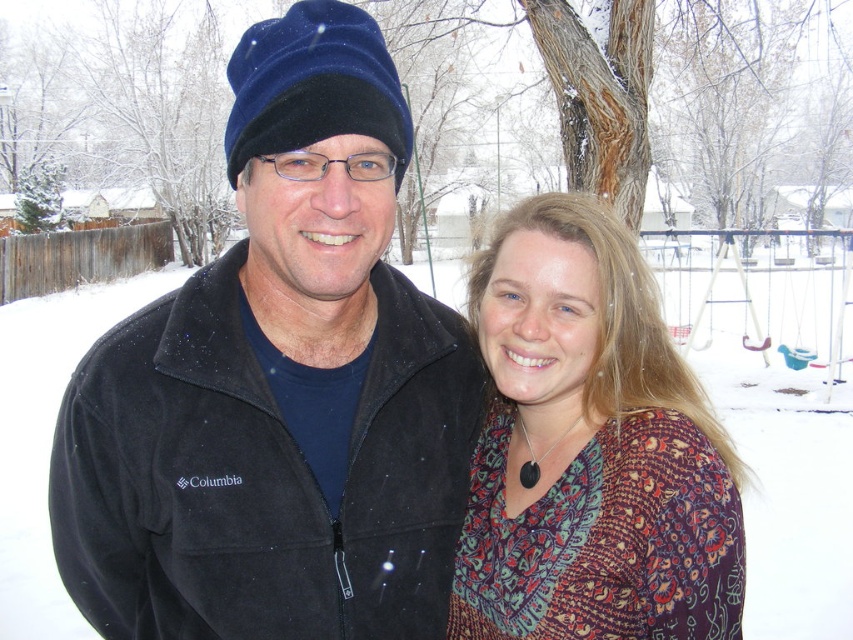
Question: Can you confirm if brown bark tree at upper center is positioned below patterned fabric blouse at center?

Choices:
 (A) yes
 (B) no

Answer: (B)

Question: Does suede jacket at center have a smaller size compared to brown bark tree at upper center?

Choices:
 (A) yes
 (B) no

Answer: (A)

Question: Which point is closer to the camera?

Choices:
 (A) white fluffy snow at center
 (B) patterned fabric blouse at center
 (C) brown bark tree at upper center

Answer: (B)

Question: Does brown bark tree at upper center appear over white fluffy snow at center?

Choices:
 (A) yes
 (B) no

Answer: (A)

Question: Which point is closer to the camera?

Choices:
 (A) suede jacket at center
 (B) patterned fabric blouse at center

Answer: (A)

Question: Based on their relative distances, which object is nearer to the white fluffy snow at center?

Choices:
 (A) brown bark tree at upper center
 (B) patterned fabric blouse at center

Answer: (B)